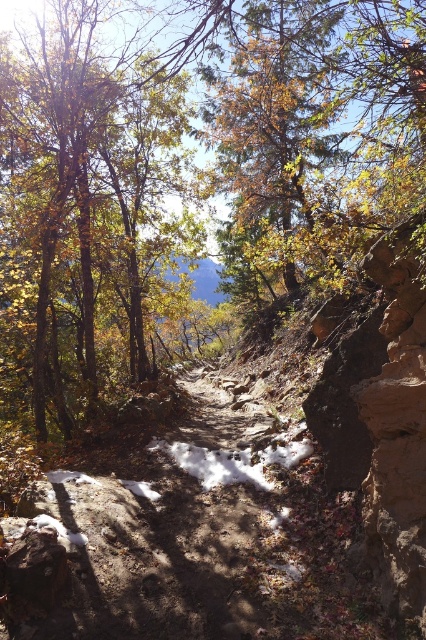
Which is above, brown leafy tree at center or white fluffy snow at center?

brown leafy tree at center is higher up.

Does point (290, 227) lie behind point (247, 452)?

That is True.

Where is `brown leafy tree at center`? This screenshot has height=640, width=426. brown leafy tree at center is located at coordinates (190, 170).